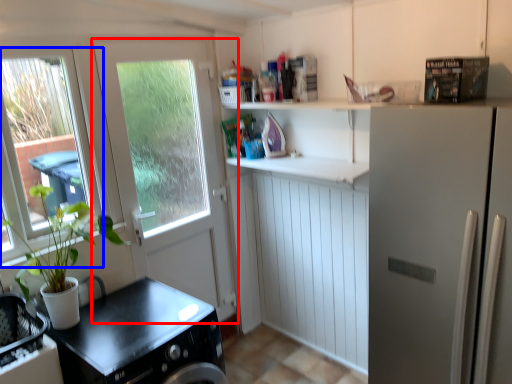
Question: Which object is further to the camera taking this photo, door (highlighted by a red box) or window (highlighted by a blue box)?

Choices:
 (A) door
 (B) window

Answer: (A)